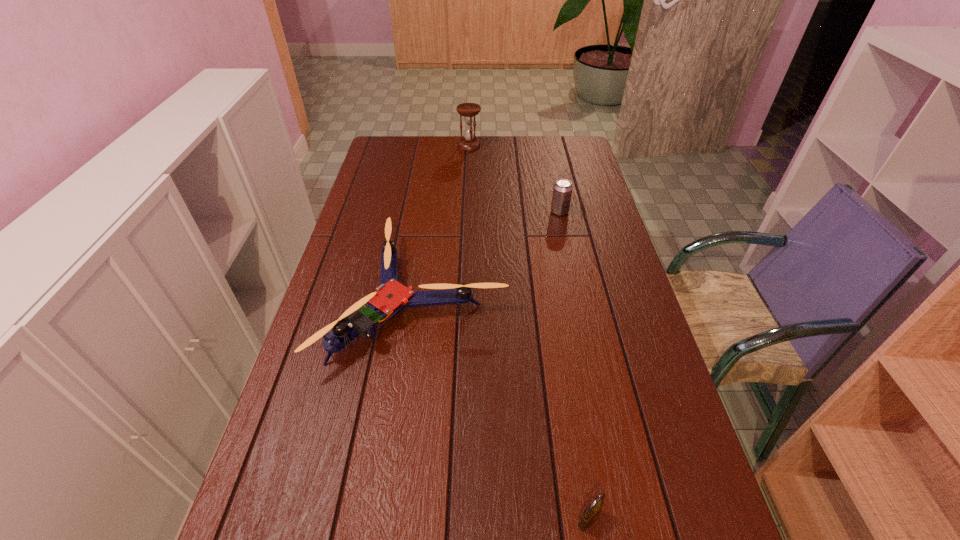
Where is `empty space that is in between the nearest object and the rightmost object`? This screenshot has width=960, height=540. empty space that is in between the nearest object and the rightmost object is located at coordinates (574, 366).

Find the location of a particular element. The image size is (960, 540). free space between the farthest object and the beer can is located at coordinates (515, 179).

Find the location of a particular element. The height and width of the screenshot is (540, 960). empty space between the tallest object and the nearest object is located at coordinates (529, 333).

The height and width of the screenshot is (540, 960). Find the location of `vacant area that lies between the third farthest object and the nearest object`. vacant area that lies between the third farthest object and the nearest object is located at coordinates (504, 409).

At what (x,y) coordinates should I click in order to perform the action: click on vacant point located between the third object from left to right and the tallest object. Please return your answer as a coordinate pair (x, y). Image resolution: width=960 pixels, height=540 pixels. Looking at the image, I should click on (529, 333).

Locate an element on the screen. The image size is (960, 540). free point between the farthest object and the padlock is located at coordinates (529, 333).

At what (x,y) coordinates should I click in order to perform the action: click on free space between the second object from right to left and the third farthest object. Please return your answer as a coordinate pair (x, y). Looking at the image, I should click on (504, 409).

Where is `object that can be found as the third closest to the drone`? object that can be found as the third closest to the drone is located at coordinates (469, 110).

At what (x,y) coordinates should I click in order to perform the action: click on the third closest object relative to the third farthest object. Please return your answer as a coordinate pair (x, y). This screenshot has width=960, height=540. Looking at the image, I should click on (469, 110).

This screenshot has width=960, height=540. In order to click on free space that satisfies the following two spatial constraints: 1. on the back side of the tallest object; 2. on the right side of the third farthest object in this screenshot , I will do `click(441, 146)`.